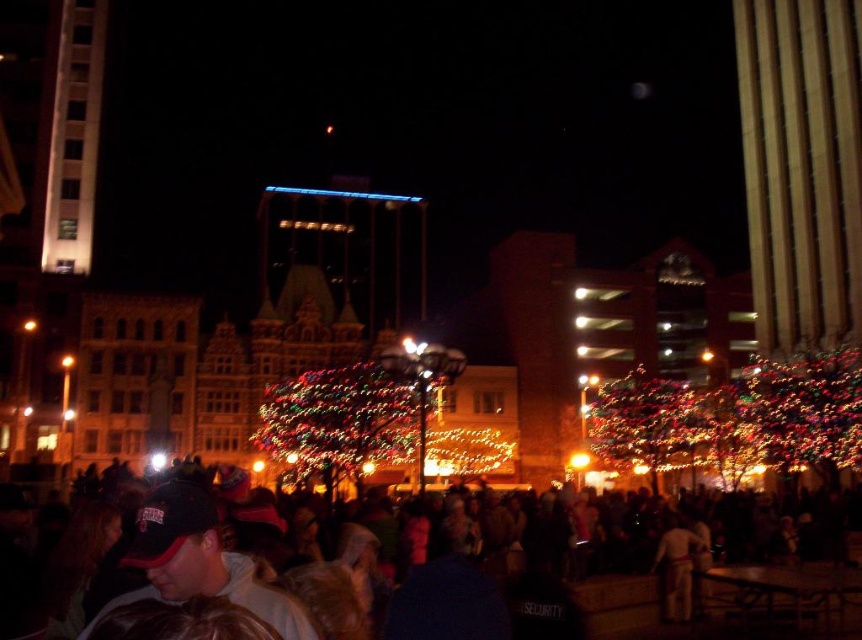
Does point (353, 433) lie behind point (653, 566)?

That is True.

At what (x,y) coordinates should I click in order to perform the action: click on illuminated plastic tree at center. Please return your answer as a coordinate pair (x, y). Looking at the image, I should click on (341, 419).

Locate an element on the screen. Image resolution: width=862 pixels, height=640 pixels. illuminated plastic tree at center is located at coordinates (341, 419).

Is dark clothing crowd at center to the right of dark blue fabric cap at lower left from the viewer's perspective?

Correct, you'll find dark clothing crowd at center to the right of dark blue fabric cap at lower left.

Which is in front, point (422, 593) or point (248, 596)?

Point (248, 596)

Who is more distant from viewer, (x=340, y=579) or (x=164, y=508)?

Positioned behind is point (x=340, y=579).

This screenshot has height=640, width=862. I want to click on dark clothing crowd at center, so click(x=334, y=584).

Does dark clothing crowd at center have a greater width compared to light brown leather jacket at lower right?

Yes, dark clothing crowd at center is wider than light brown leather jacket at lower right.

How far apart are dark clothing crowd at center and light brown leather jacket at lower right?

dark clothing crowd at center and light brown leather jacket at lower right are 11.74 meters apart.

Locate an element on the screen. This screenshot has height=640, width=862. dark clothing crowd at center is located at coordinates (334, 584).